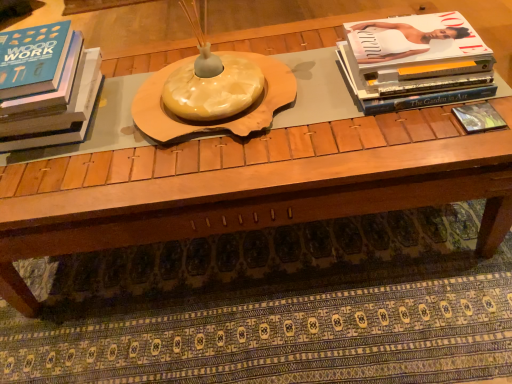
Image resolution: width=512 pixels, height=384 pixels. I want to click on free spot in front of matte black book at left, which appears as the third book when viewed from the right, so click(x=68, y=185).